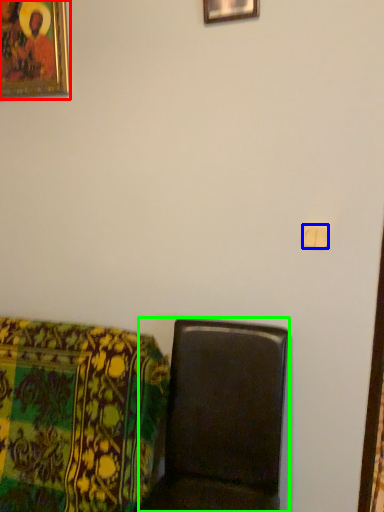
Question: Which object is the farthest from picture frame (highlighted by a red box)? Choose among these: light switch (highlighted by a blue box) or furniture (highlighted by a green box).

Choices:
 (A) light switch
 (B) furniture

Answer: (B)